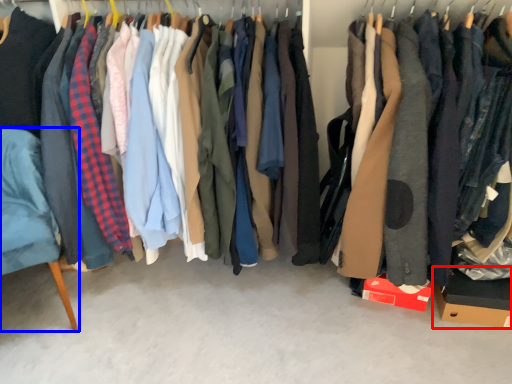
Question: Which of the following is the closest to the observer, cardboard box (highlighted by a red box) or furniture (highlighted by a blue box)?

Choices:
 (A) cardboard box
 (B) furniture

Answer: (B)